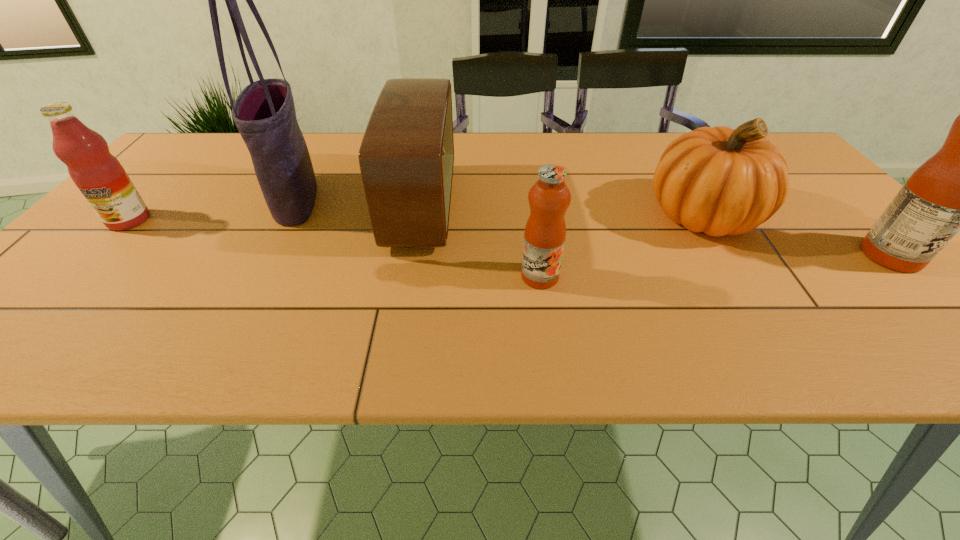
Find the location of a particular element. The height and width of the screenshot is (540, 960). vacant space at the right edge is located at coordinates (839, 217).

You are a GUI agent. You are given a task and a screenshot of the screen. Output one action in this format:
    pyautogui.click(x=<x>, y=<y>)
    Task: Click on the free space at the near left corner of the desktop
    This screenshot has height=540, width=960.
    Given the screenshot: What is the action you would take?
    pyautogui.click(x=67, y=300)

In the image, there is a desktop. Find the location of `vacant space at the near right corner`. vacant space at the near right corner is located at coordinates (921, 303).

Where is `vacant area that lies between the pumpkin and the second object from left to right`? The image size is (960, 540). vacant area that lies between the pumpkin and the second object from left to right is located at coordinates (500, 207).

At what (x,y) coordinates should I click in order to perform the action: click on vacant area between the second tallest object and the pumpkin. Please return your answer as a coordinate pair (x, y). Image resolution: width=960 pixels, height=540 pixels. Looking at the image, I should click on (798, 235).

You are a GUI agent. You are given a task and a screenshot of the screen. Output one action in this format:
    pyautogui.click(x=<x>, y=<y>)
    Task: Click on the free space between the leftmost object and the tallest object
    This screenshot has width=960, height=540.
    Given the screenshot: What is the action you would take?
    pyautogui.click(x=212, y=210)

Where is `vacant space in between the fourth object from right to left and the tallest fruit juice`? vacant space in between the fourth object from right to left and the tallest fruit juice is located at coordinates (656, 231).

Where is `free space between the leftmost fruit juice and the fifth shortest object`? The height and width of the screenshot is (540, 960). free space between the leftmost fruit juice and the fifth shortest object is located at coordinates (510, 238).

Locate an element on the screen. This screenshot has height=540, width=960. free spot between the leftmost fruit juice and the second fruit juice from right to left is located at coordinates (334, 248).

Identify the location of blank region between the fourth object from left to right and the rightmost object. (715, 266).